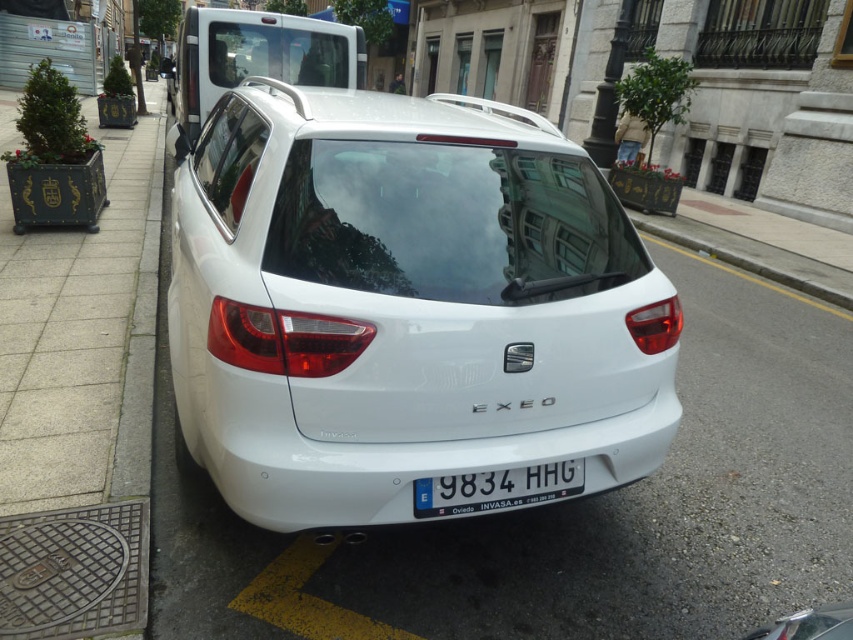
Can you confirm if white matte hatchback at center is bigger than white plastic license plate at center?

Correct, white matte hatchback at center is larger in size than white plastic license plate at center.

Does white matte hatchback at center appear under white plastic license plate at center?

Actually, white matte hatchback at center is above white plastic license plate at center.

This screenshot has height=640, width=853. Identify the location of white matte hatchback at center. (403, 305).